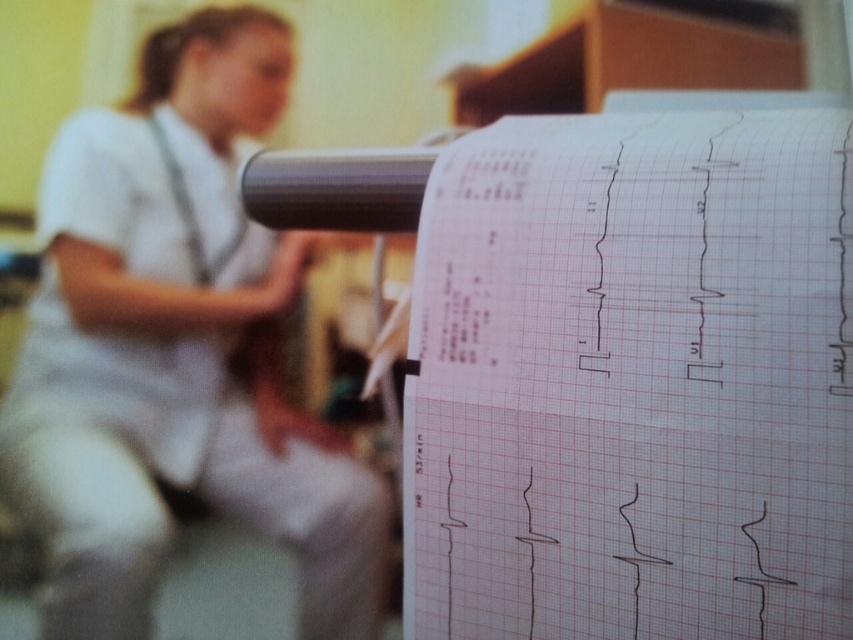
You are a medical student observing an ECG printout. You notice the white graph paper at center and the white uniform at upper left. Which object appears smaller in the image?

The white graph paper at center appears smaller compared to the white uniform at upper left.

You are a medical student observing an ECG printout. You notice the white graph paper at center and the white uniform at upper left. Which object is closer to you?

The white graph paper at center is closer to you because it is in front of the white uniform at upper left.